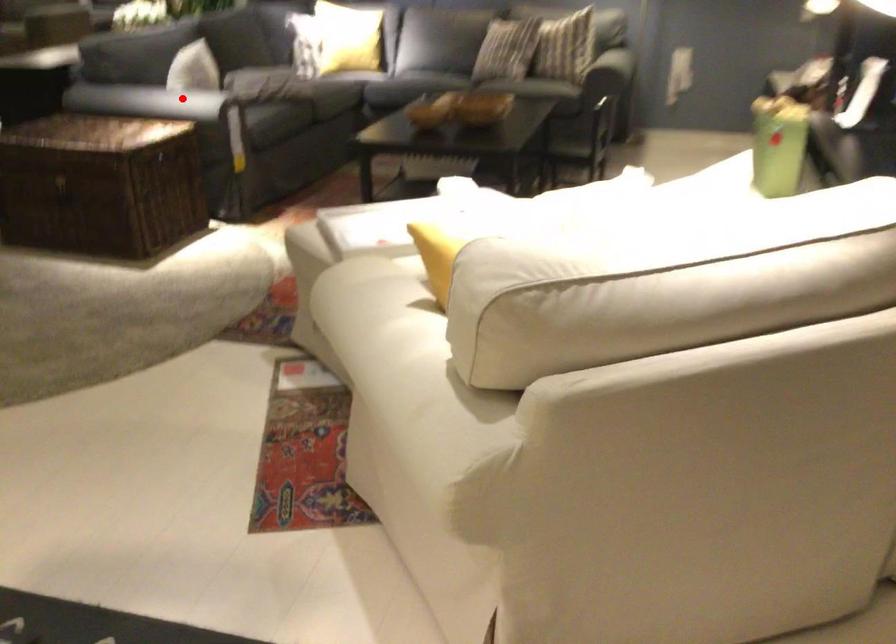
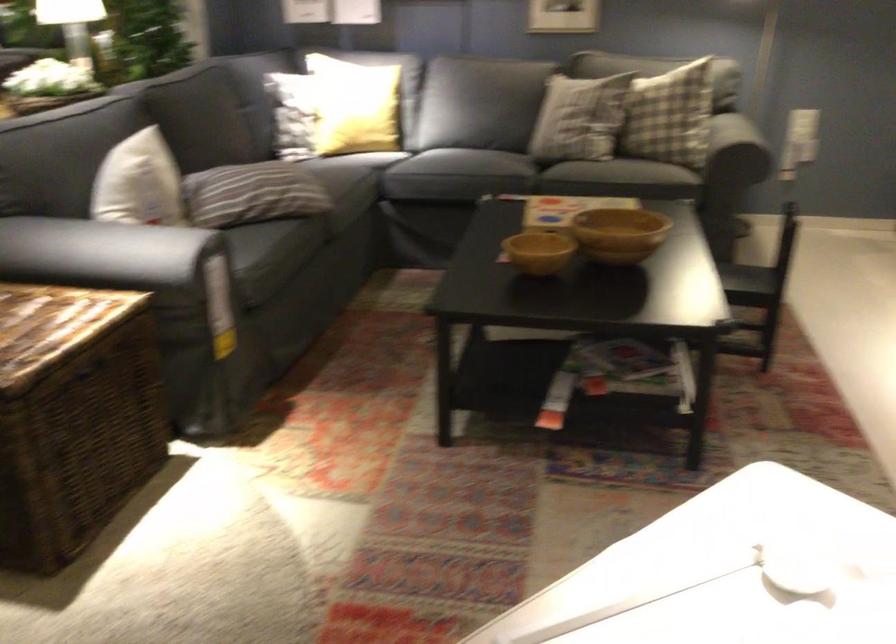
The point at the highlighted location is marked in the first image. Where is the corresponding point in the second image?

(117, 252)